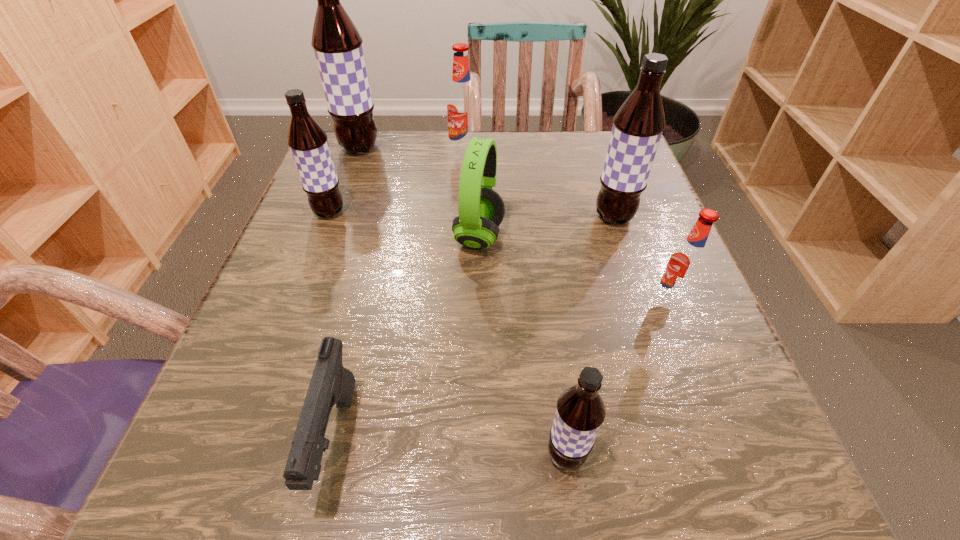
Select which root beer is the fourth closest to the sixth object from left to right. Please provide its 2D coordinates. Your answer should be formatted as a tuple, i.e. [(x, y)], where the tuple contains the x and y coordinates of a point satisfying the conditions above.

[(462, 109)]

Where is `the third closest root beer to the tallest root beer`? the third closest root beer to the tallest root beer is located at coordinates (637, 127).

Locate an element on the screen. The height and width of the screenshot is (540, 960). the third closest brown root beer to the tallest root beer is located at coordinates (580, 411).

Locate which brown root beer is the third closest to the seventh shortest object. Please provide its 2D coordinates. Your answer should be formatted as a tuple, i.e. [(x, y)], where the tuple contains the x and y coordinates of a point satisfying the conditions above.

[(308, 143)]

Image resolution: width=960 pixels, height=540 pixels. Find the location of `free spot that satisfies the following two spatial constraints: 1. on the back side of the smaller red root beer; 2. on the left side of the third root beer from right to left`. free spot that satisfies the following two spatial constraints: 1. on the back side of the smaller red root beer; 2. on the left side of the third root beer from right to left is located at coordinates (545, 302).

Find the location of `vacant area that satisfies the following two spatial constraints: 1. on the front side of the green headset; 2. on the right side of the nearer red root beer`. vacant area that satisfies the following two spatial constraints: 1. on the front side of the green headset; 2. on the right side of the nearer red root beer is located at coordinates (479, 302).

Image resolution: width=960 pixels, height=540 pixels. In order to click on blank space that satisfies the following two spatial constraints: 1. on the back side of the farthest brown root beer; 2. on the right side of the second smallest brown root beer in this screenshot , I will do `click(353, 148)`.